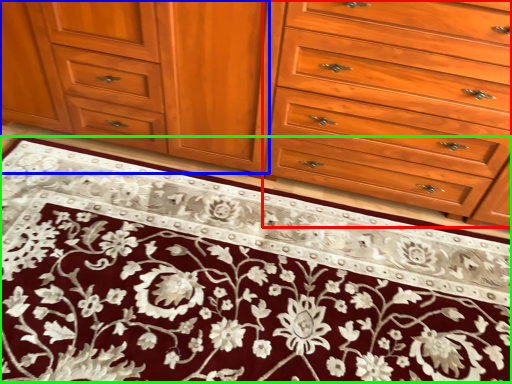
Question: Considering the real-world distances, which object is closest to drawer (highlighted by a red box)? cabinetry (highlighted by a blue box) or doormat (highlighted by a green box).

Choices:
 (A) cabinetry
 (B) doormat

Answer: (A)